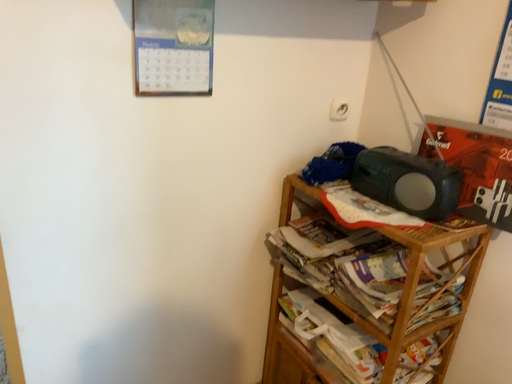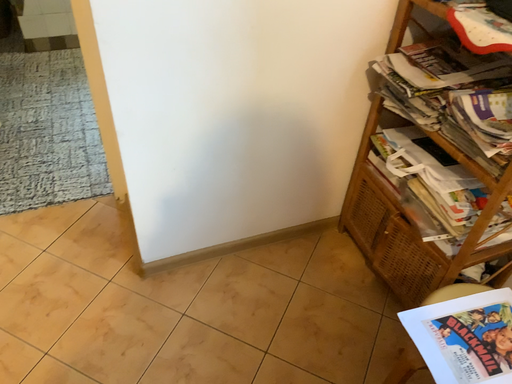
Question: How did the camera likely rotate when shooting the video?

Choices:
 (A) rotated downward
 (B) rotated upward

Answer: (A)